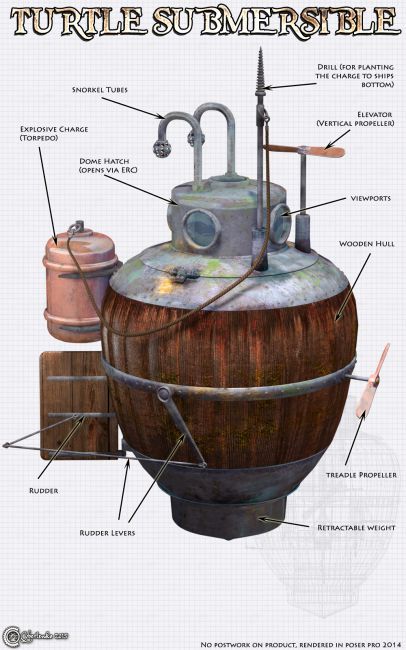
Identify the location of wood handle. The width and height of the screenshot is (406, 650). (321, 150).